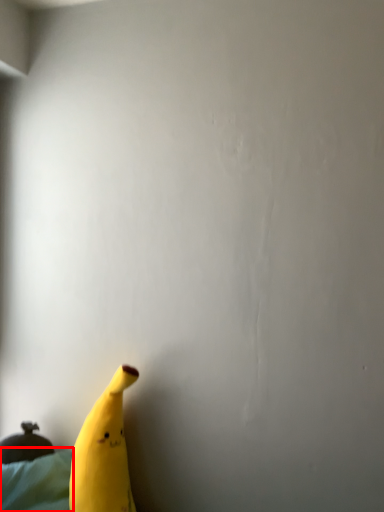
Question: From the image, what is the correct spatial relationship of sheet (annotated by the red box) in relation to banana?

Choices:
 (A) right
 (B) left

Answer: (B)